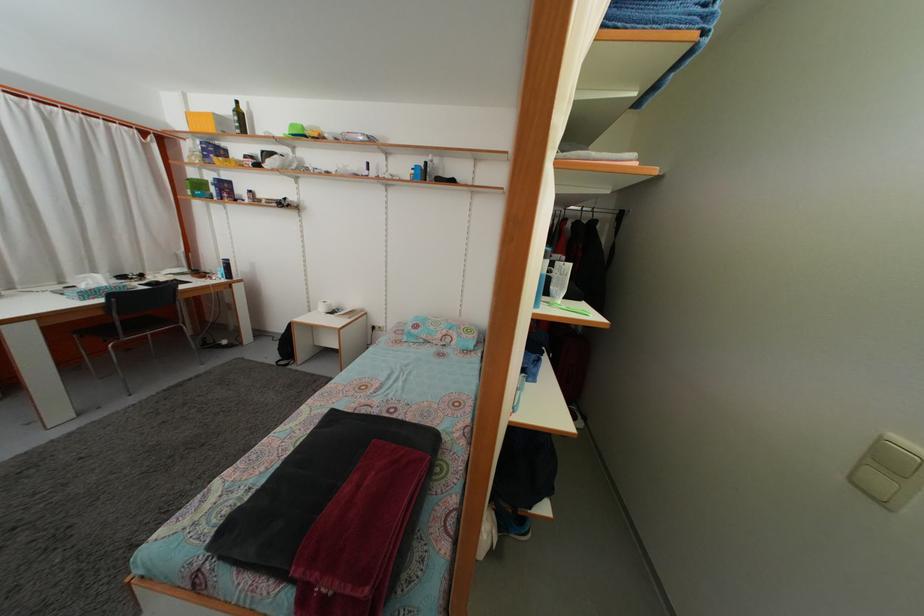
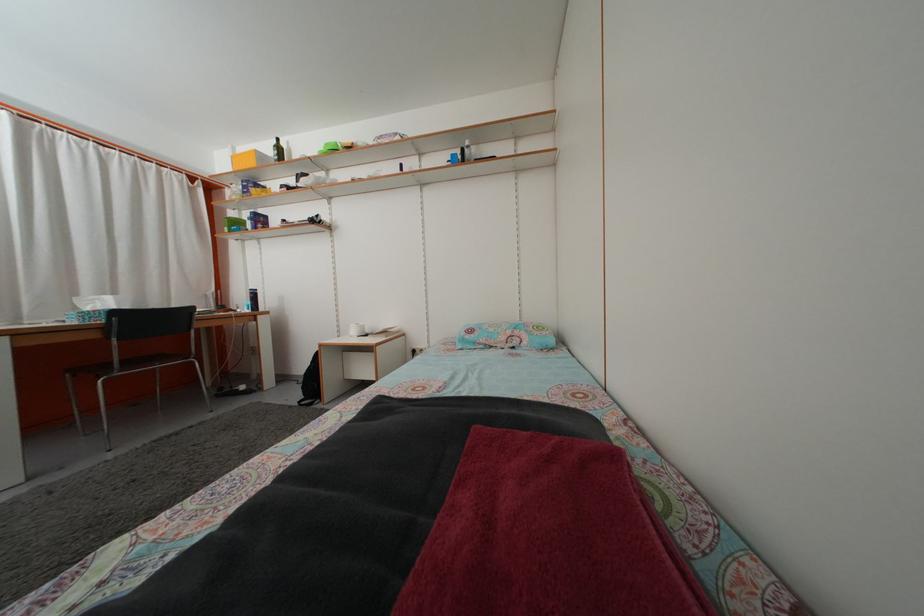
Locate, in the second image, the point that corresponds to (x=285, y=365) in the first image.

(309, 405)